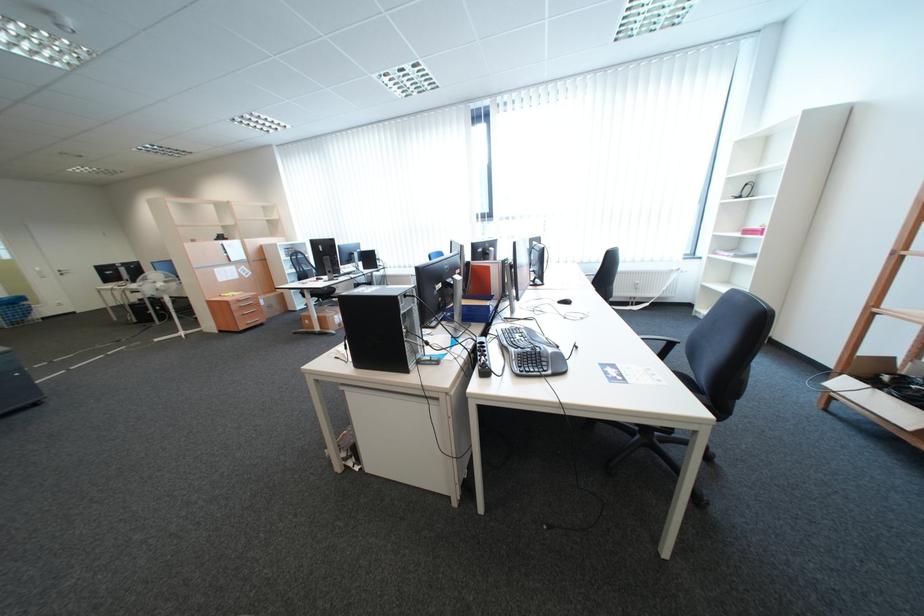
Find where to lift the phone handset. Please return your answer as a coordinate pair (x, y).

(489, 370)